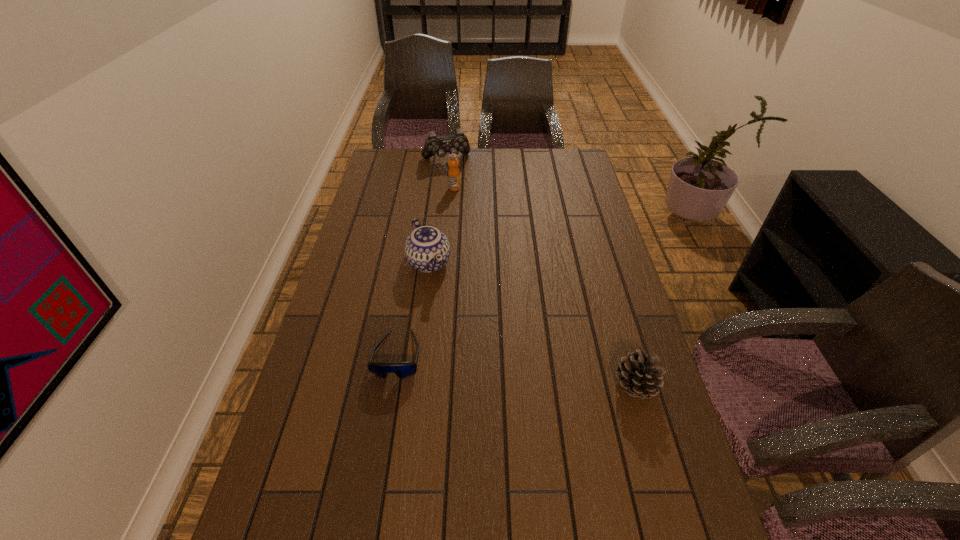
Where is `vacant space located 0.240m on the surface of the farthest object with buttons`? The image size is (960, 540). vacant space located 0.240m on the surface of the farthest object with buttons is located at coordinates (461, 197).

Identify the location of free space located 0.360m on the surface of the farthest object with buttons. (468, 214).

Locate an element on the screen. The width and height of the screenshot is (960, 540). free region located on the surface of the farthest object with buttons is located at coordinates (462, 198).

Image resolution: width=960 pixels, height=540 pixels. I want to click on vacant space situated 0.210m on the front label of the second farthest object, so click(469, 222).

This screenshot has width=960, height=540. In order to click on vacant space located 0.350m on the front label of the second farthest object in this screenshot , I will do `click(479, 246)`.

What are the coordinates of `vacant space situated 0.280m on the front label of the second farthest object` in the screenshot? It's located at (474, 233).

This screenshot has width=960, height=540. In order to click on object at the far edge in this screenshot , I will do `click(453, 144)`.

This screenshot has width=960, height=540. Find the location of `object that is at the right edge`. object that is at the right edge is located at coordinates (637, 374).

Image resolution: width=960 pixels, height=540 pixels. What are the coordinates of `free spot at the far edge of the desktop` in the screenshot? It's located at (516, 177).

Where is `free space at the near edge of the desktop`? The width and height of the screenshot is (960, 540). free space at the near edge of the desktop is located at coordinates (444, 524).